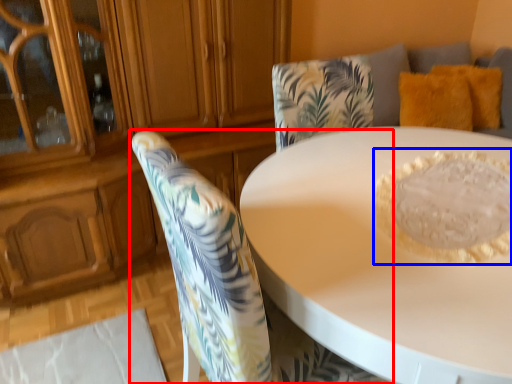
Question: Which of the following is the farthest to the observer, chair (highlighted by a red box) or food (highlighted by a blue box)?

Choices:
 (A) chair
 (B) food

Answer: (B)